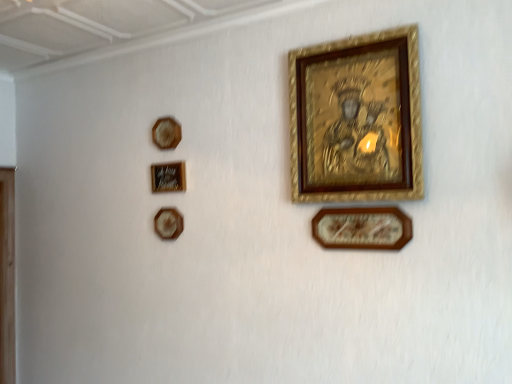
Question: From a real-world perspective, is matte brown picture frame at upper left, the fourth picture frame when ordered from right to left, beneath matte black picture frame at upper left, the 3th picture frame when ordered from left to right?

Choices:
 (A) yes
 (B) no

Answer: (A)

Question: Is matte brown picture frame at upper left, the fourth picture frame when ordered from right to left, in front of matte black picture frame at upper left, the 3th picture frame when ordered from left to right?

Choices:
 (A) no
 (B) yes

Answer: (A)

Question: Is matte brown picture frame at upper left, the fourth picture frame when ordered from right to left, not near matte black picture frame at upper left, the 3th picture frame in the right-to-left sequence?

Choices:
 (A) no
 (B) yes

Answer: (A)

Question: Is matte brown picture frame at upper left, the fourth picture frame when ordered from right to left, oriented towards matte black picture frame at upper left, the 3th picture frame when ordered from left to right?

Choices:
 (A) no
 (B) yes

Answer: (A)

Question: Does matte brown picture frame at upper left, acting as the 2th picture frame starting from the left, contain matte black picture frame at upper left, the 3th picture frame when ordered from left to right?

Choices:
 (A) no
 (B) yes

Answer: (A)

Question: From a real-world perspective, is wooden plaque at upper left, the first picture frame viewed from the left, positioned above or below wooden picture frame at lower center, which is counted as the fifth picture frame, starting from the left?

Choices:
 (A) below
 (B) above

Answer: (B)

Question: In terms of size, does wooden plaque at upper left, the first picture frame viewed from the left, appear bigger or smaller than wooden picture frame at lower center, which is counted as the fifth picture frame, starting from the left?

Choices:
 (A) big
 (B) small

Answer: (B)

Question: Visually, is wooden plaque at upper left, placed as the 5th picture frame when sorted from right to left, positioned to the left or to the right of wooden picture frame at lower center, placed as the first picture frame when sorted from right to left?

Choices:
 (A) left
 (B) right

Answer: (A)

Question: In terms of width, does wooden plaque at upper left, placed as the 5th picture frame when sorted from right to left, look wider or thinner when compared to wooden picture frame at lower center, which is counted as the fifth picture frame, starting from the left?

Choices:
 (A) thin
 (B) wide

Answer: (B)

Question: Relative to gold textured picture frame at upper center, positioned as the second picture frame in right-to-left order, is wooden picture frame at lower center, placed as the first picture frame when sorted from right to left, in front or behind?

Choices:
 (A) front
 (B) behind

Answer: (B)

Question: Would you say wooden picture frame at lower center, which is counted as the fifth picture frame, starting from the left, is to the left or to the right of gold textured picture frame at upper center, positioned as the second picture frame in right-to-left order, in the picture?

Choices:
 (A) right
 (B) left

Answer: (A)

Question: Is wooden picture frame at lower center, which is counted as the fifth picture frame, starting from the left, inside the boundaries of gold textured picture frame at upper center, which ranks as the 4th picture frame in left-to-right order, or outside?

Choices:
 (A) outside
 (B) inside

Answer: (A)

Question: Considering the positions of wooden picture frame at lower center, which is counted as the fifth picture frame, starting from the left, and gold textured picture frame at upper center, positioned as the second picture frame in right-to-left order, in the image, is wooden picture frame at lower center, which is counted as the fifth picture frame, starting from the left, taller or shorter than gold textured picture frame at upper center, positioned as the second picture frame in right-to-left order,?

Choices:
 (A) tall
 (B) short

Answer: (B)

Question: Visually, is matte black picture frame at upper left, the 3th picture frame in the right-to-left sequence, positioned to the left or to the right of gold textured picture frame at upper center, positioned as the second picture frame in right-to-left order?

Choices:
 (A) right
 (B) left

Answer: (B)

Question: Is point (181, 185) positioned closer to the camera than point (378, 119)?

Choices:
 (A) closer
 (B) farther

Answer: (B)